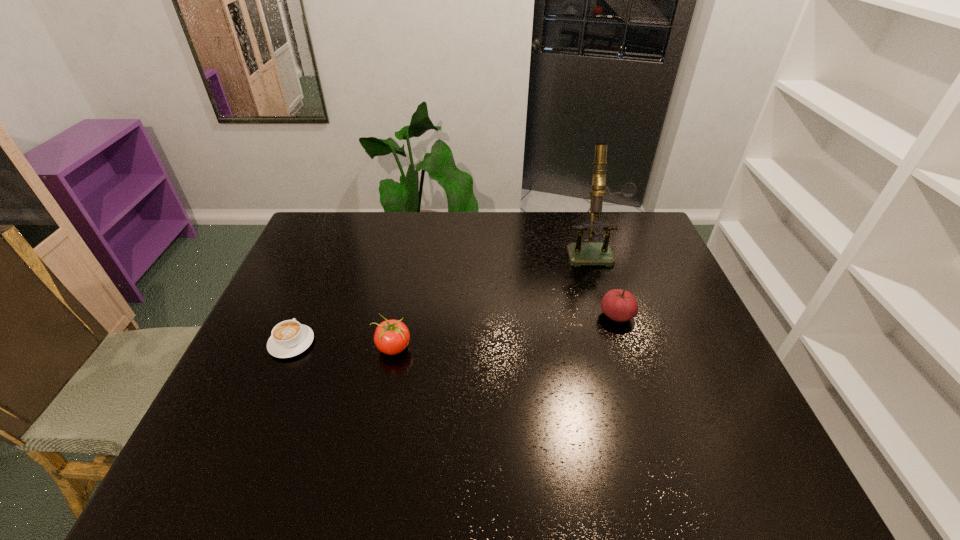
I want to click on vacant point at the far left corner, so click(x=332, y=214).

Locate an element on the screen. This screenshot has height=540, width=960. free space at the far right corner of the desktop is located at coordinates (620, 211).

In the image, there is a desktop. At what (x,y) coordinates should I click in order to perform the action: click on free region at the near right corner. Please return your answer as a coordinate pair (x, y). The width and height of the screenshot is (960, 540). Looking at the image, I should click on pos(770,462).

The width and height of the screenshot is (960, 540). Find the location of `free space between the left tomato and the microscope`. free space between the left tomato and the microscope is located at coordinates (492, 299).

The width and height of the screenshot is (960, 540). In order to click on free space between the tallest object and the farther tomato in this screenshot , I will do `click(605, 282)`.

The image size is (960, 540). Identify the location of free spot between the right tomato and the cappuccino. (454, 329).

Image resolution: width=960 pixels, height=540 pixels. Identify the location of free space between the nearer tomato and the microscope. (492, 299).

Find the location of a particular element. empty space between the cappuccino and the left tomato is located at coordinates (343, 345).

Locate an element on the screen. free spot between the tallest object and the shortest object is located at coordinates (442, 296).

Image resolution: width=960 pixels, height=540 pixels. I want to click on empty location between the shortest object and the farthest object, so click(x=442, y=296).